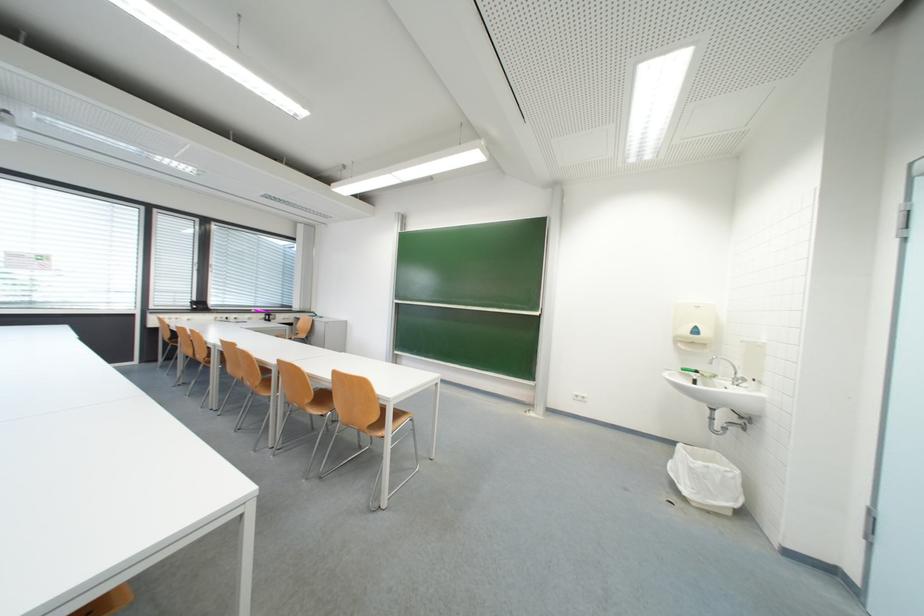
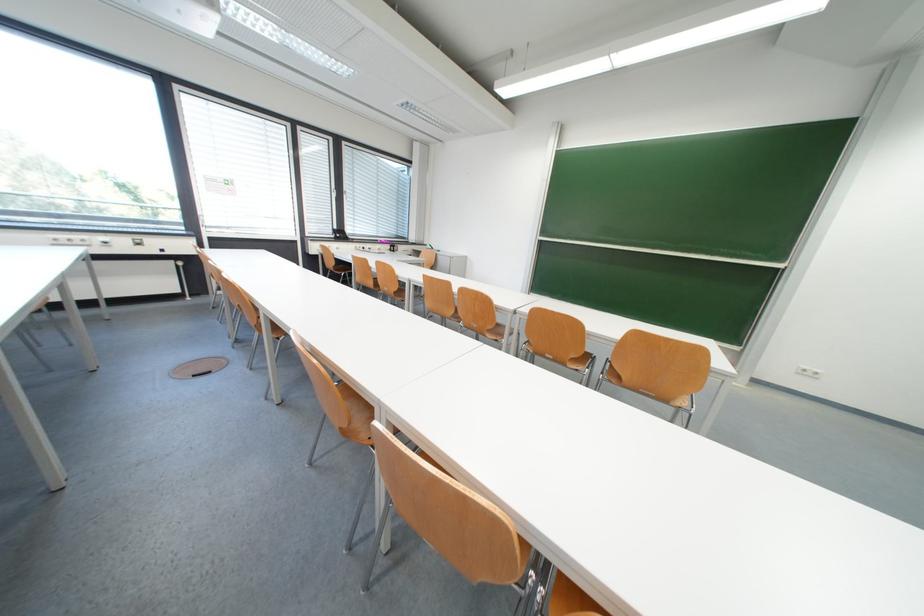
Question: The images are taken continuously from a first-person perspective. In which direction are you moving?

Choices:
 (A) Left
 (B) Right
 (C) Forward
 (D) Backward

Answer: (A)